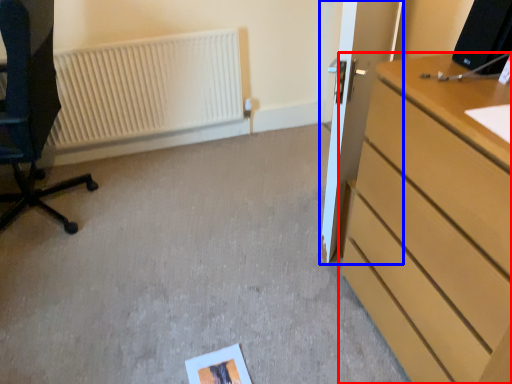
Question: Which object appears farthest to the camera in this image, chest of drawers (highlighted by a red box) or door (highlighted by a blue box)?

Choices:
 (A) chest of drawers
 (B) door

Answer: (B)